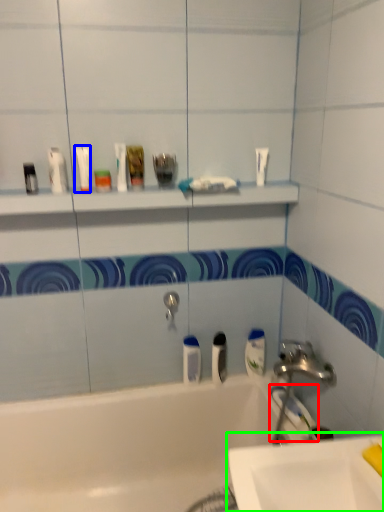
Question: Based on their relative distances, which object is nearer to toothbrush (highlighted by a red box)? Choose from mouthwash (highlighted by a blue box) and sink (highlighted by a green box).

Choices:
 (A) mouthwash
 (B) sink

Answer: (B)